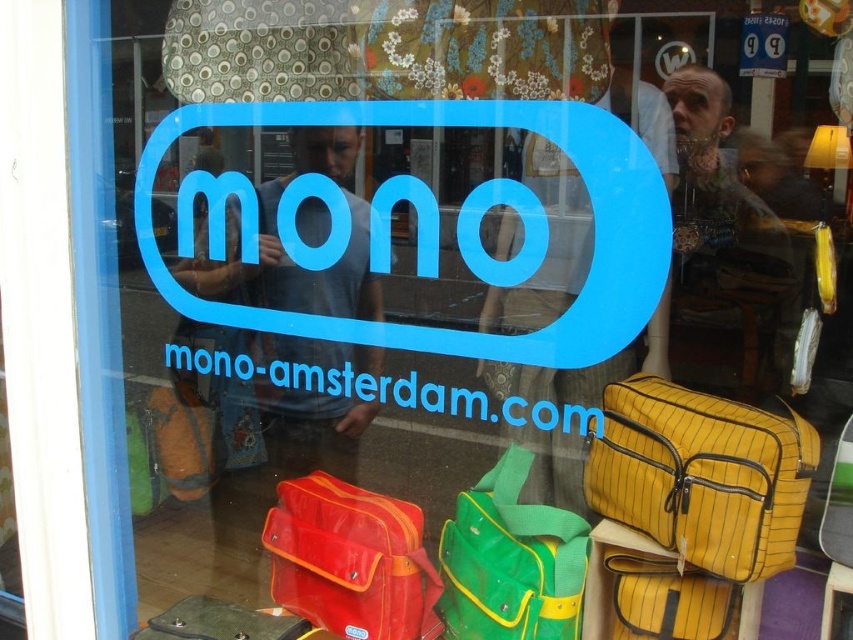
Can you confirm if yellow striped fabric bag at lower right is shorter than matte red bag at center?

No.

Does point (639, 513) lie behind point (306, 506)?

That is False.

This screenshot has width=853, height=640. In order to click on yellow striped fabric bag at lower right in this screenshot , I will do `click(701, 476)`.

At what (x,y) coordinates should I click in order to perform the action: click on yellow striped fabric bag at lower right. Please return your answer as a coordinate pair (x, y). Looking at the image, I should click on (701, 476).

Who is positioned more to the right, yellow striped fabric bag at lower right or yellow striped bag at center?

yellow striped fabric bag at lower right is more to the right.

At what (x,y) coordinates should I click in order to perform the action: click on yellow striped fabric bag at lower right. Please return your answer as a coordinate pair (x, y). This screenshot has width=853, height=640. Looking at the image, I should click on (701, 476).

Where is `matte red bag at center`? matte red bag at center is located at coordinates (350, 561).

In the scene shown: Does matte red bag at center come in front of green fabric bag at center?

No, matte red bag at center is further to the viewer.

Is point (321, 600) farther from camera compared to point (519, 513)?

That is True.

Locate an element on the screen. This screenshot has width=853, height=640. matte red bag at center is located at coordinates (350, 561).